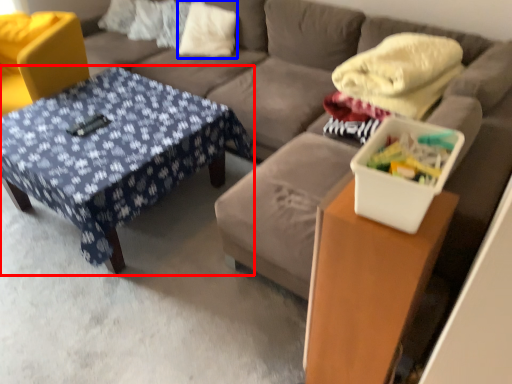
Question: Which object is further to the camera taking this photo, table (highlighted by a red box) or pillow (highlighted by a blue box)?

Choices:
 (A) table
 (B) pillow

Answer: (B)